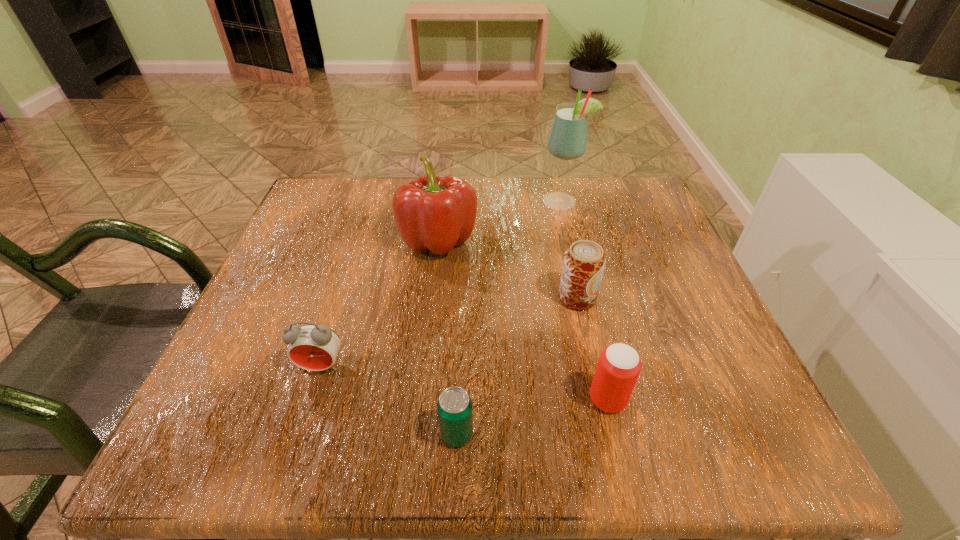
Image resolution: width=960 pixels, height=540 pixels. I want to click on free space at the near edge, so click(331, 407).

Find the location of a particular element. Image resolution: width=960 pixels, height=540 pixels. free space at the left edge of the desktop is located at coordinates [x=334, y=319].

The height and width of the screenshot is (540, 960). What are the coordinates of `vacant area at the right edge of the desktop` in the screenshot? It's located at (681, 382).

The width and height of the screenshot is (960, 540). In the image, there is a desktop. What are the coordinates of `free space at the far left corner` in the screenshot? It's located at (351, 199).

In the image, there is a desktop. Where is `blank space at the near left corner`? blank space at the near left corner is located at coordinates (290, 407).

Identify the location of vacant space at the near right corner of the desktop. Image resolution: width=960 pixels, height=540 pixels. (740, 413).

The image size is (960, 540). In order to click on blank region between the leftmost object and the farthest beer can in this screenshot , I will do `click(449, 332)`.

Locate an element on the screen. This screenshot has height=540, width=960. free space between the alarm clock and the farthest beer can is located at coordinates (449, 332).

I want to click on vacant area between the third farthest object and the fifth farthest object, so click(x=592, y=349).

Image resolution: width=960 pixels, height=540 pixels. I want to click on unoccupied position between the third farthest object and the third nearest object, so click(x=449, y=332).